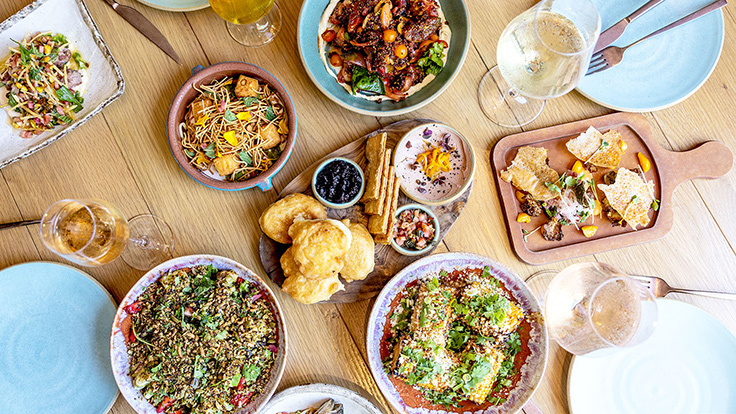
Locate an element on the screen. white plate is located at coordinates (300, 399), (665, 369).